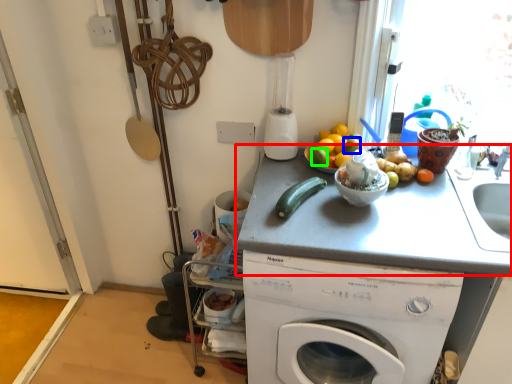
Question: Considering the real-world distances, which object is farthest from counter top (highlighted by a red box)? lime (highlighted by a blue box) or lime (highlighted by a green box)?

Choices:
 (A) lime
 (B) lime

Answer: (A)